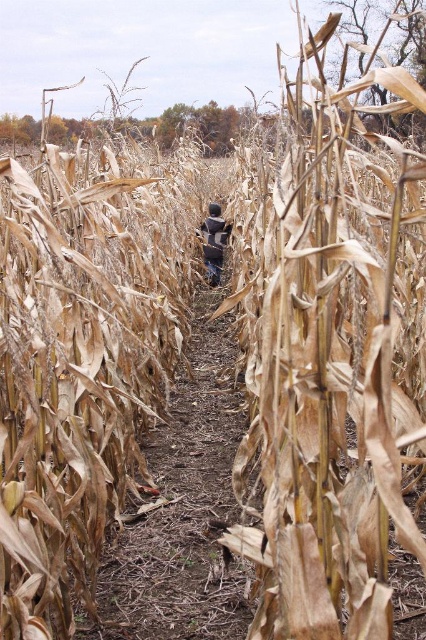
You are standing at the entrance of the corn maze and see the point marked at coordinates (x=331, y=353). What is located at that point?

The brown dried corn at center is located at point (x=331, y=353).